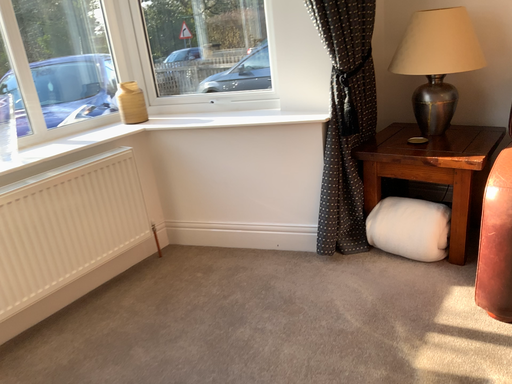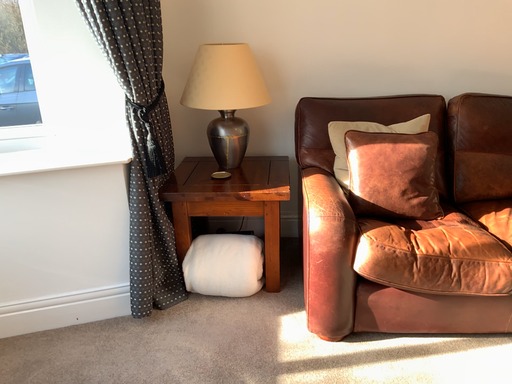
Question: How did the camera likely rotate when shooting the video?

Choices:
 (A) rotated right
 (B) rotated left

Answer: (A)